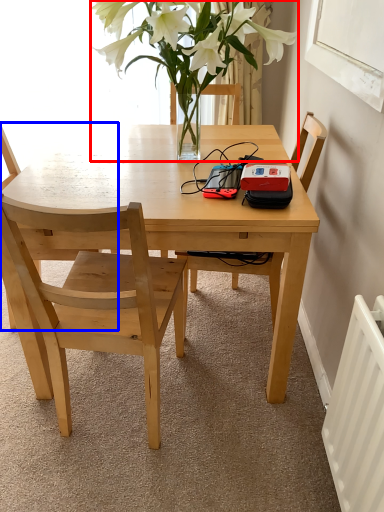
Question: Which of the following is the farthest to the observer, houseplant (highlighted by a red box) or chair (highlighted by a blue box)?

Choices:
 (A) houseplant
 (B) chair

Answer: (B)